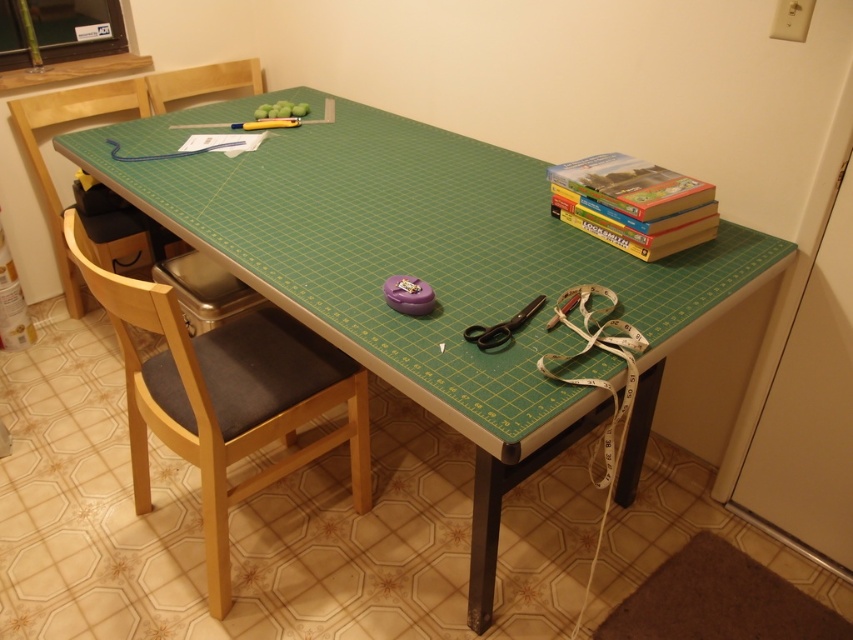
Is brown felt mat at lower right closer to the viewer compared to black plastic scissors at center?

No, it is not.

Who is more forward, (730, 634) or (525, 320)?

Point (525, 320)

This screenshot has height=640, width=853. Find the location of `brown felt mat at lower right`. brown felt mat at lower right is located at coordinates (718, 600).

Is wooden chair at left smaller than black plastic scissors at center?

No.

The image size is (853, 640). Find the location of `wooden chair at left`. wooden chair at left is located at coordinates 64,122.

The image size is (853, 640). Find the location of `wooden chair at left`. wooden chair at left is located at coordinates (64, 122).

Consider the image. Between wooden chair at center and wooden chair at upper left, which one appears on the left side from the viewer's perspective?

wooden chair at upper left

Can you confirm if wooden chair at center is positioned to the left of wooden chair at upper left?

In fact, wooden chair at center is to the right of wooden chair at upper left.

You are a GUI agent. You are given a task and a screenshot of the screen. Output one action in this format:
    pyautogui.click(x=<x>, y=<y>)
    Task: Click on the wooden chair at center
    
    Given the screenshot: What is the action you would take?
    pyautogui.click(x=225, y=397)

You are a GUI agent. You are given a task and a screenshot of the screen. Output one action in this format:
    pyautogui.click(x=<x>, y=<y>)
    Task: Click on the wooden chair at center
    Image resolution: width=853 pixels, height=640 pixels.
    Given the screenshot: What is the action you would take?
    pyautogui.click(x=225, y=397)